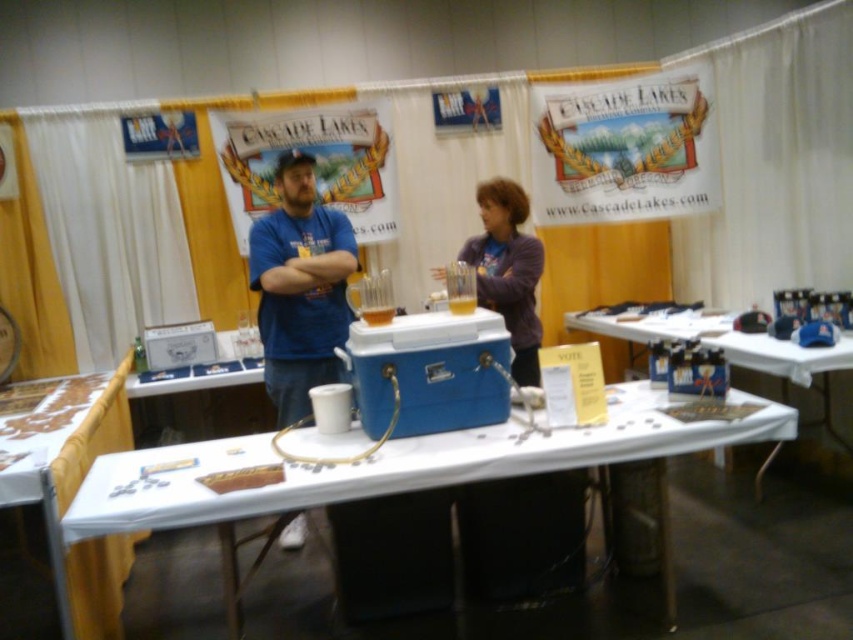
You are setting up a booth for Cascade Lakes Brewing Company and need to arrange the blue plastic cooler at center and the matte blue cooler at center on the table. According to the scene description, which cooler should be placed to the left?

The blue plastic cooler at center should be placed to the left of the matte blue cooler at center because the blue plastic cooler at center is positioned on the left side of matte blue cooler at center.